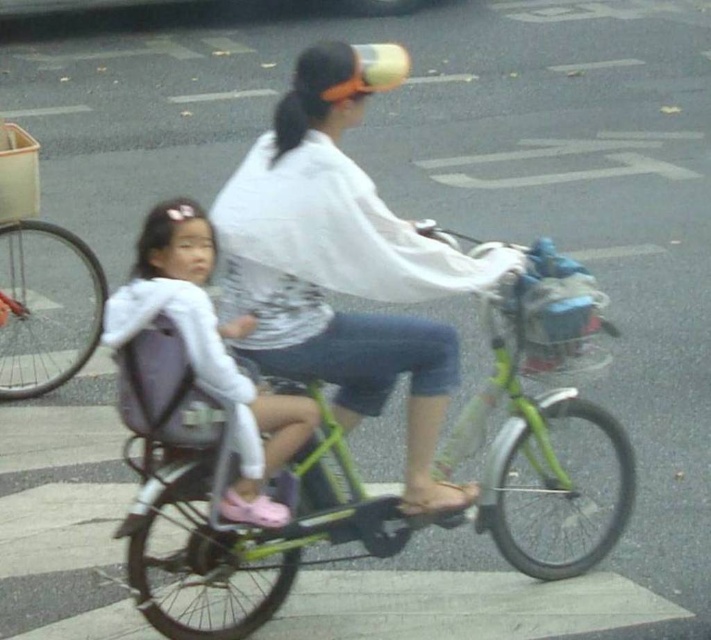
Which is behind, point (510, 432) or point (252, 308)?

The point (510, 432) is more distant.

Who is positioned more to the right, green matte bicycle at center or white matte shirt at center?

green matte bicycle at center is more to the right.

You are a GUI agent. You are given a task and a screenshot of the screen. Output one action in this format:
    pyautogui.click(x=<x>, y=<y>)
    Task: Click on the green matte bicycle at center
    
    Given the screenshot: What is the action you would take?
    pyautogui.click(x=230, y=480)

At what (x,y) coordinates should I click in order to perform the action: click on green matte bicycle at center. Please return your answer as a coordinate pair (x, y). This screenshot has width=711, height=640. Looking at the image, I should click on (230, 480).

Does white matte shirt at center appear over white matte jacket at center?

Correct, white matte shirt at center is located above white matte jacket at center.

Between point (411, 320) and point (159, 250), which one is positioned behind?

The point (411, 320) is more distant.

Find the location of `white matte shirt at center`. white matte shirt at center is located at coordinates (343, 262).

In the scene shown: Is green matte bicycle at center smaller than white matte jacket at center?

Actually, green matte bicycle at center might be larger than white matte jacket at center.

Does green matte bicycle at center appear under white matte jacket at center?

Yes, green matte bicycle at center is below white matte jacket at center.

Measure the distance between green matte bicycle at center and camera.

The distance of green matte bicycle at center from camera is 12.71 feet.

Locate an element on the screen. The width and height of the screenshot is (711, 640). green matte bicycle at center is located at coordinates (230, 480).